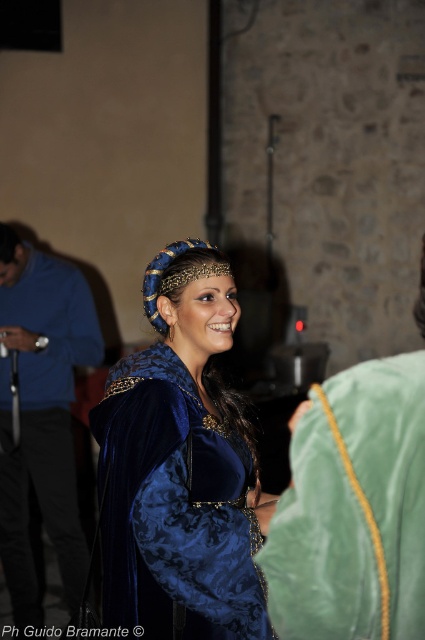
Describe the element at coordinates (353, 509) in the screenshot. I see `green velvet robe at center` at that location.

Who is positioned more to the left, green velvet robe at center or velvet blue robe at center?

From the viewer's perspective, velvet blue robe at center appears more on the left side.

Describe the element at coordinates (353, 509) in the screenshot. I see `green velvet robe at center` at that location.

At what (x,y) coordinates should I click in order to perform the action: click on green velvet robe at center. Please return your answer as a coordinate pair (x, y). This screenshot has height=640, width=425. Looking at the image, I should click on (353, 509).

Is velvet blue dress at center shorter than velvet blue robe at center?

Correct, velvet blue dress at center is not as tall as velvet blue robe at center.

Which is below, velvet blue dress at center or velvet blue robe at center?

Positioned lower is velvet blue robe at center.

Between point (102, 481) and point (45, 388), which one is positioned in front?

Point (102, 481) is more forward.

Image resolution: width=425 pixels, height=640 pixels. I want to click on velvet blue dress at center, so pyautogui.click(x=181, y=467).

Can you confirm if velvet blue dress at center is smaller than green velvet robe at center?

No.

Which of these two, velvet blue dress at center or green velvet robe at center, stands shorter?

With less height is green velvet robe at center.

The height and width of the screenshot is (640, 425). Identify the location of velvet blue dress at center. (181, 467).